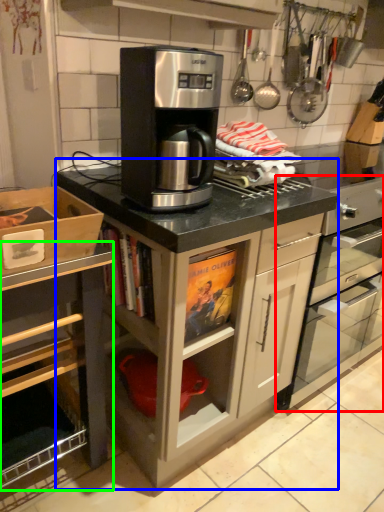
Question: Considering the real-world distances, which object is farthest from home appliance (highlighted by a red box)? cabinetry (highlighted by a blue box) or cabinetry (highlighted by a green box)?

Choices:
 (A) cabinetry
 (B) cabinetry

Answer: (B)